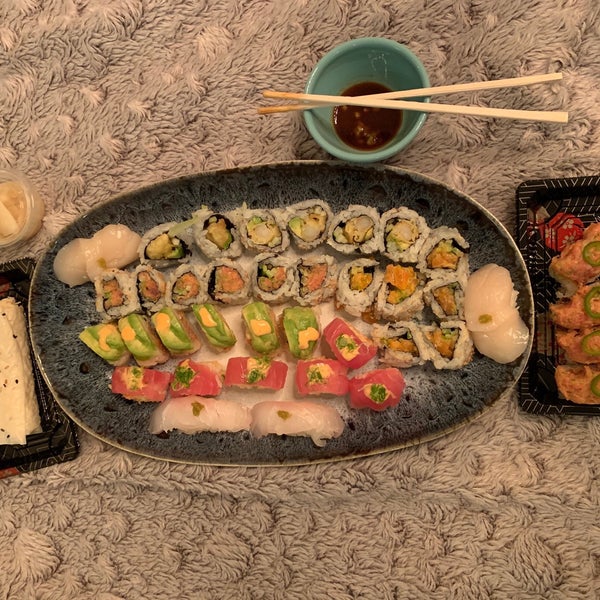
The image size is (600, 600). What are the coordinates of `platter` in the screenshot? It's located at pos(437,415).